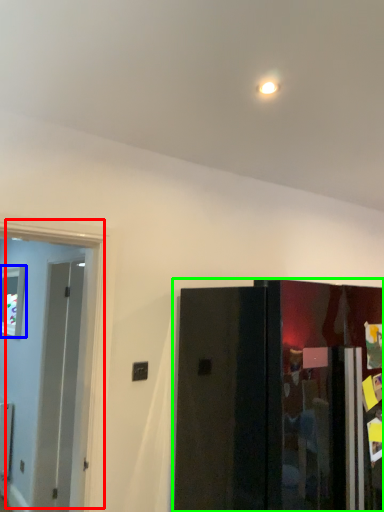
Question: Which is nearer to the door (highlighted by a red box)? window (highlighted by a blue box) or door (highlighted by a green box).

Choices:
 (A) window
 (B) door

Answer: (A)